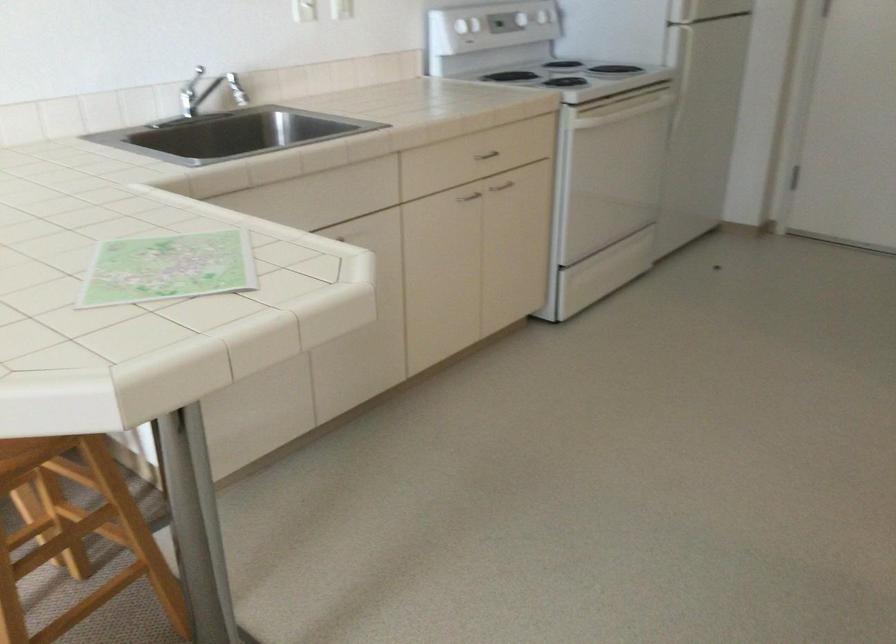
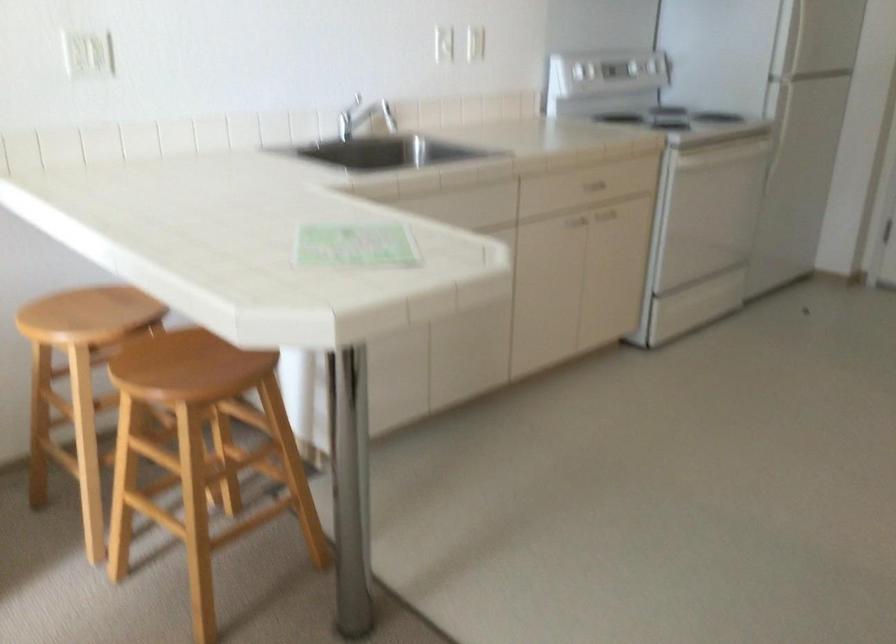
Where in the second image is the point corresponding to the point at 179,265 from the first image?

(355, 245)